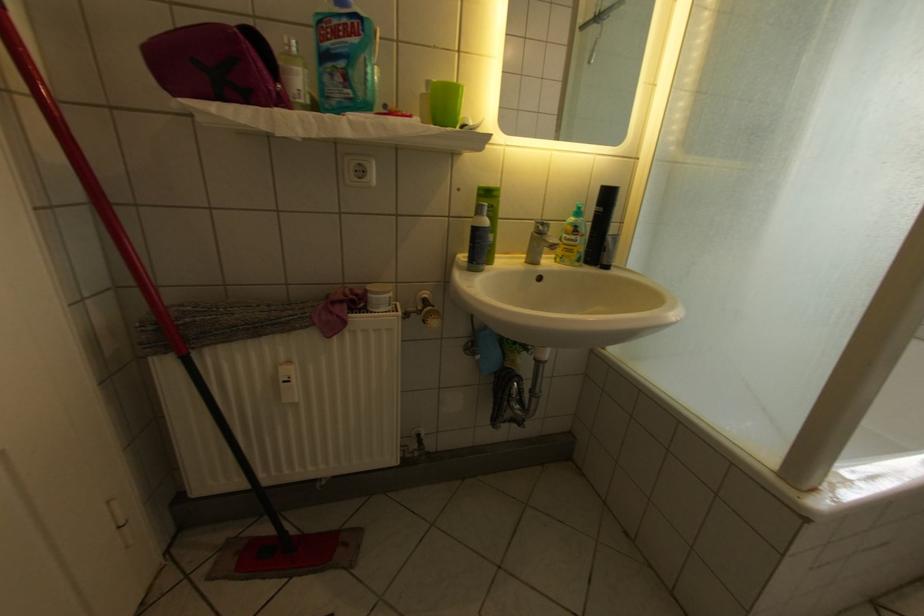
The height and width of the screenshot is (616, 924). What do you see at coordinates (539, 246) in the screenshot?
I see `the sink faucet handle` at bounding box center [539, 246].